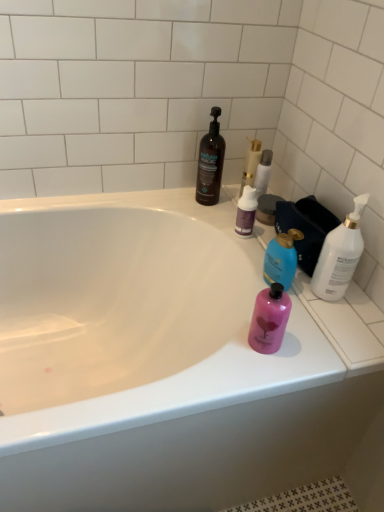
In order to click on blank area to the left of dark brown plastic bottle at upper center, arranged as the first bottle when viewed from the left in this screenshot , I will do [x=164, y=203].